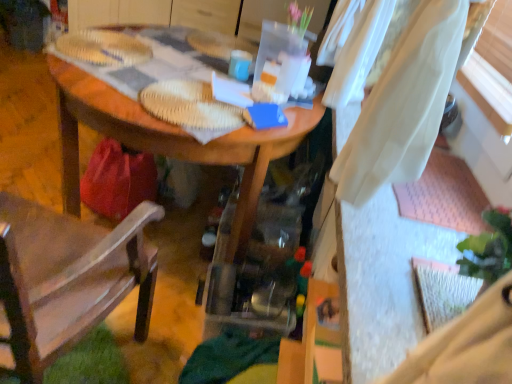
Locate an element on the screen. The height and width of the screenshot is (384, 512). free space in front of matte blue mug at center is located at coordinates (209, 78).